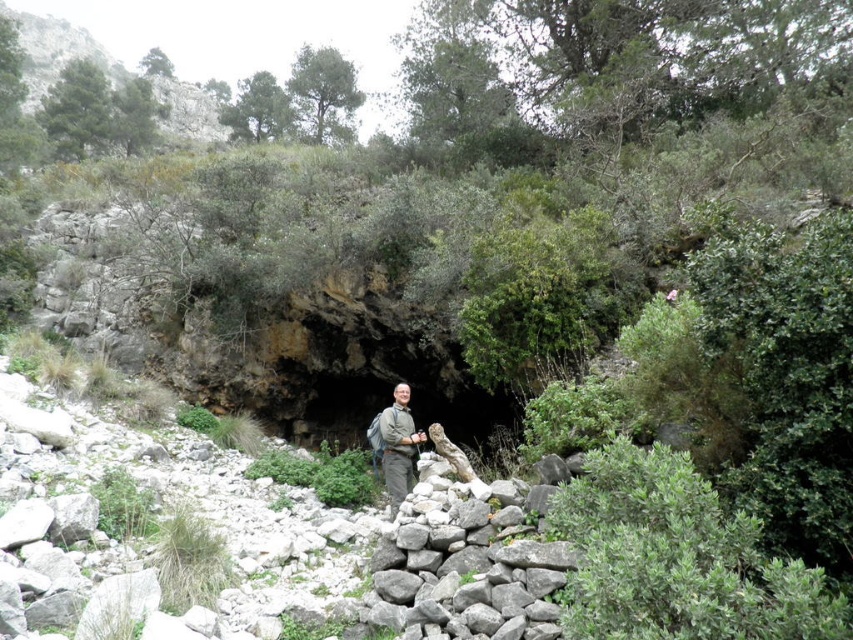
Based on the scene description, what object is located at the coordinates point (465, 568)?

The gray rough stone at center is located at point (465, 568).

You are a hiker trying to place your khaki fabric jacket at center on a stable surface. Can you safely place it on the gray rough stone at center?

The gray rough stone at center is positioned under khaki fabric jacket at center, so yes, you can safely place the khaki fabric jacket at center on the gray rough stone at center since it is already supporting it.

Based on the photo, you are a hiker trying to navigate through the rocky terrain. You see the gray rough stone at center and the khaki fabric jacket at center. Which object is positioned to the right of the other?

The gray rough stone at center is to the right of the khaki fabric jacket at center, so the gray rough stone at center is positioned to the right of the khaki fabric jacket at center.